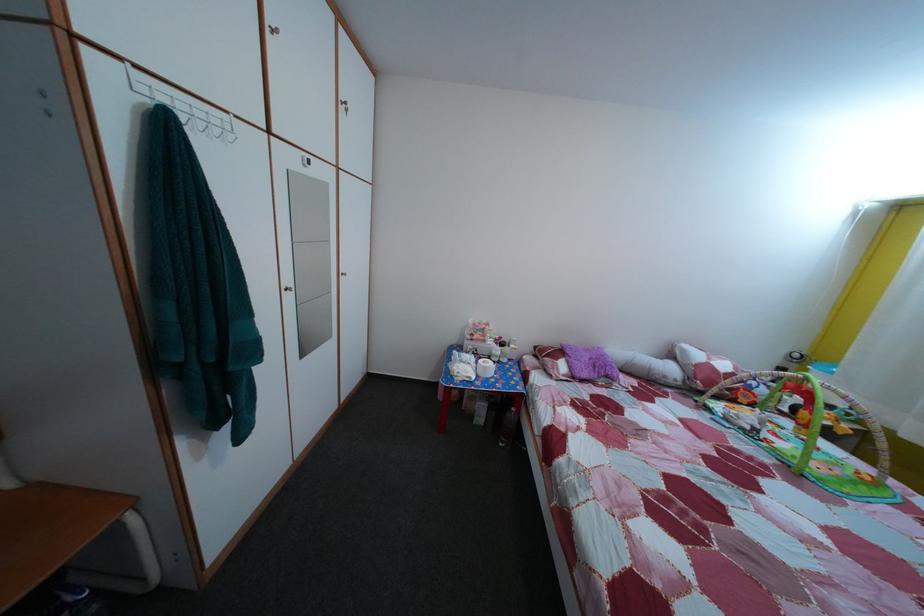
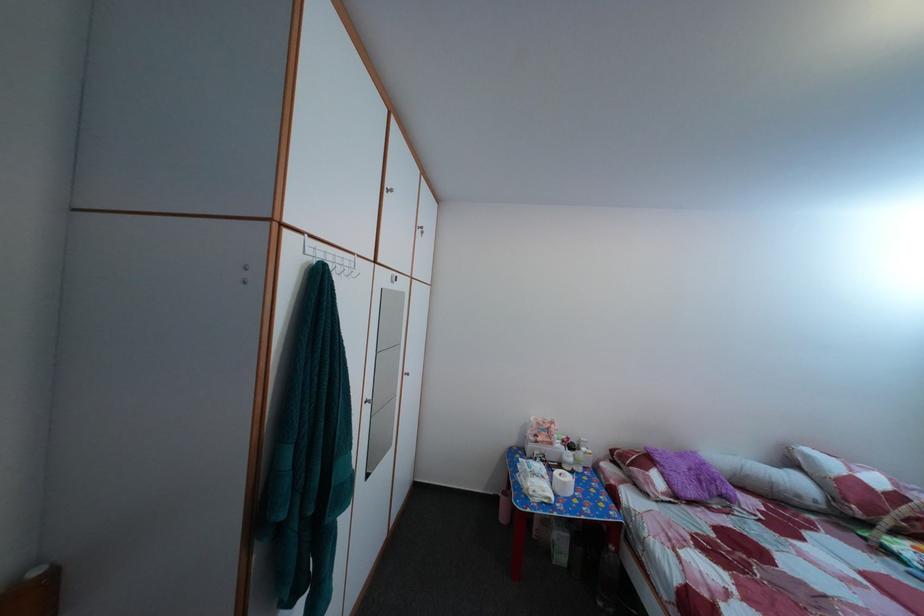
The point at (509, 346) is marked in the first image. Where is the corresponding point in the second image?

(578, 447)